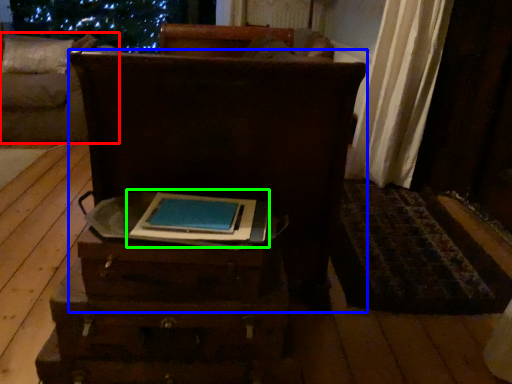
Question: Which object is the closest to the furniture (highlighted by a red box)? Choose among these: furniture (highlighted by a blue box) or book (highlighted by a green box).

Choices:
 (A) furniture
 (B) book

Answer: (A)